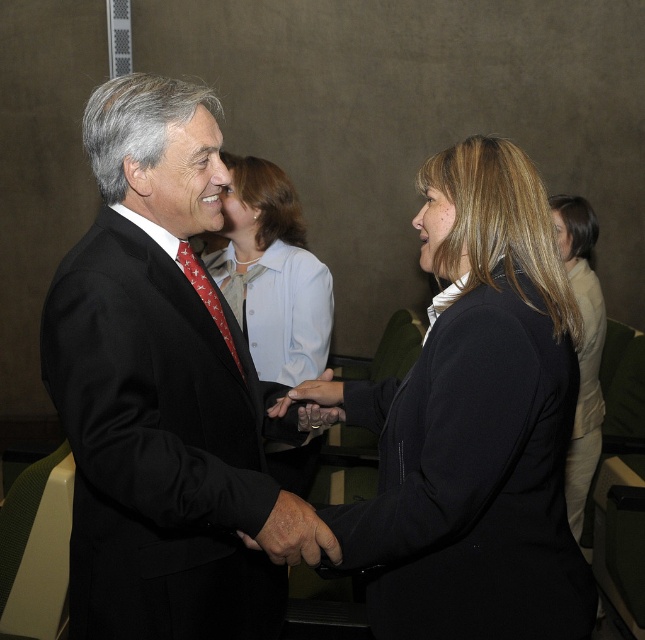
Looking at this image, you are standing at point point (70, 595) and want to take a photo of the handshake scene. The camera you have can focus on subjects within 4 feet. Will the camera be able to capture the handshake clearly?

The point (70, 595) and camera are 4.25 feet apart from each other. Since the camera can focus within 4 feet, the distance of 4.25 feet is slightly beyond the camera range. Therefore, the camera may not capture the handshake clearly.